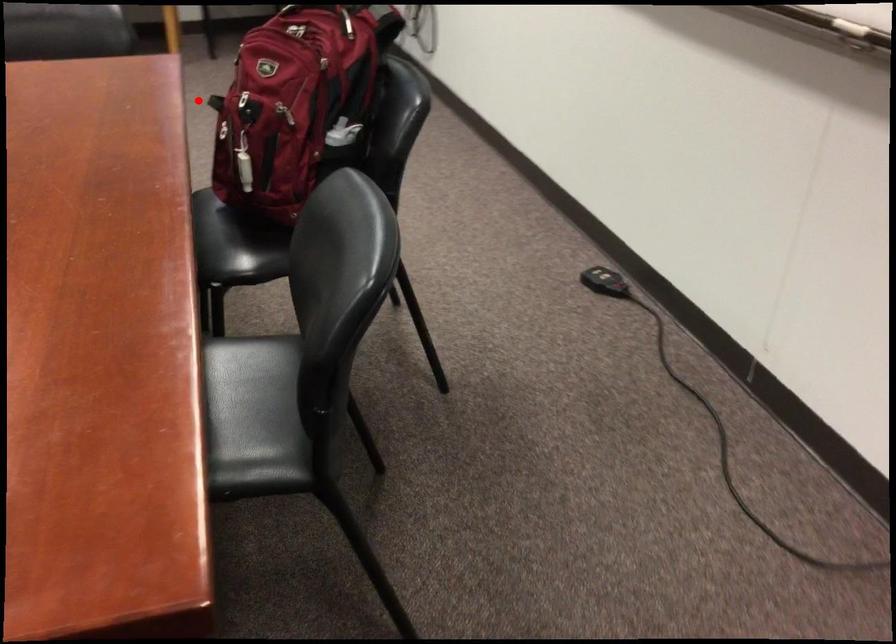
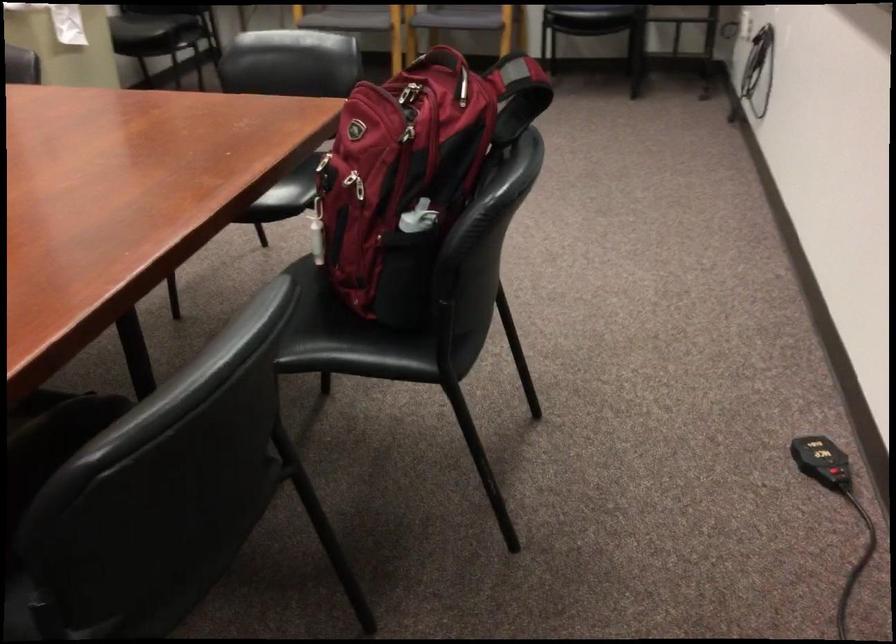
Find the pixel in the second image that matches the highlighted location in the first image.

(314, 153)